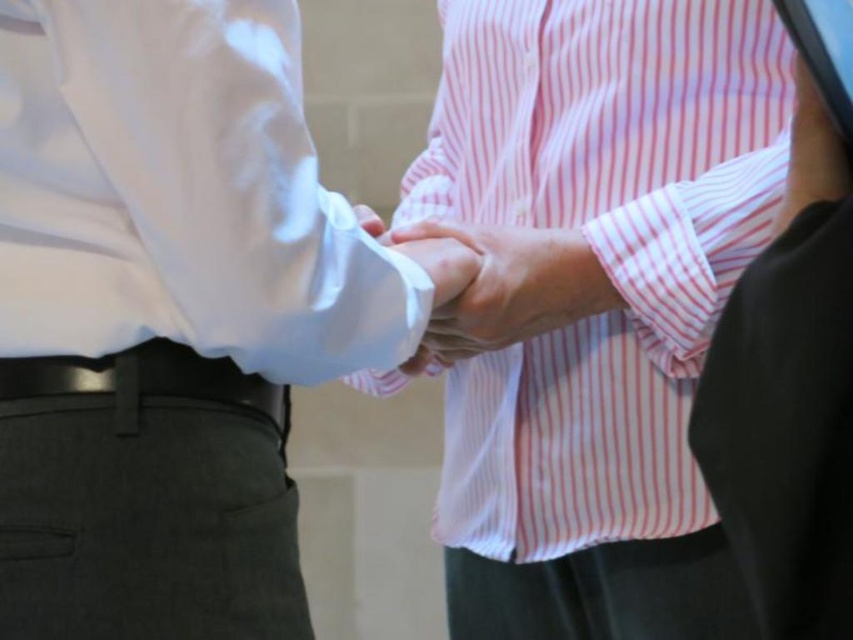
Based on the scene description, is the white smooth shirt at center positioned higher than the black leather belt at lower left?

Yes, the white smooth shirt at center is above the black leather belt at lower left, so it is positioned higher.

You are observing a handshake scene where two people are shaking hands. The pink striped shirt at center and the white matte shirt at center are both involved. From the perspective of someone facing the scene, which shirt is positioned to the right?

The pink striped shirt at center is positioned to the right of the white matte shirt at center.